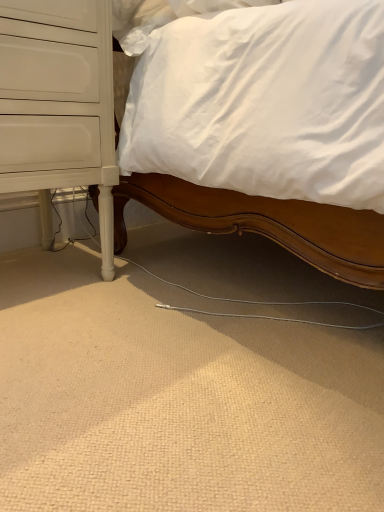
Where is `white glossy chest of drawers at left`? The height and width of the screenshot is (512, 384). white glossy chest of drawers at left is located at coordinates (58, 105).

What is the approximate height of white glossy chest of drawers at left?

white glossy chest of drawers at left is 75.96 centimeters tall.

This screenshot has width=384, height=512. Describe the element at coordinates (58, 105) in the screenshot. I see `white glossy chest of drawers at left` at that location.

At what (x,y) coordinates should I click in order to perform the action: click on white glossy chest of drawers at left. Please return your answer as a coordinate pair (x, y). The height and width of the screenshot is (512, 384). Looking at the image, I should click on (58, 105).